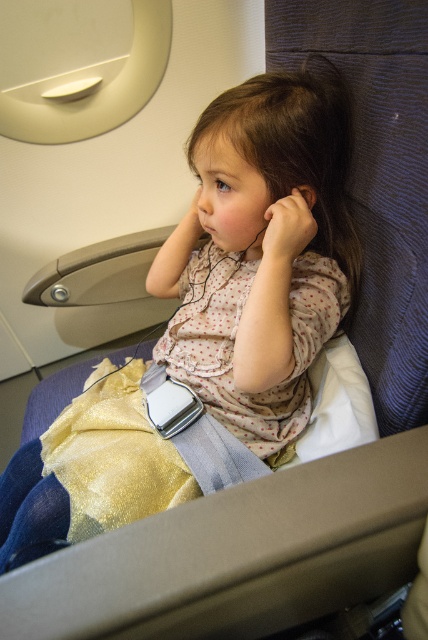
Question: Is gold glitter skirt at center smaller than matte skin hand at center?

Choices:
 (A) yes
 (B) no

Answer: (B)

Question: Which object is closer to the camera taking this photo?

Choices:
 (A) matte skin hand at center
 (B) gold glitter skirt at center

Answer: (B)

Question: Is gold glitter skirt at center above matte skin hand at center?

Choices:
 (A) yes
 (B) no

Answer: (B)

Question: Among these points, which one is farthest from the camera?

Choices:
 (A) (297, 200)
 (B) (216, 390)

Answer: (B)

Question: Which of the following is the farthest from the observer?

Choices:
 (A) matte skin hand at center
 (B) gold glitter skirt at center

Answer: (A)

Question: Is gold glitter skirt at center above matte skin hand at center?

Choices:
 (A) yes
 (B) no

Answer: (B)